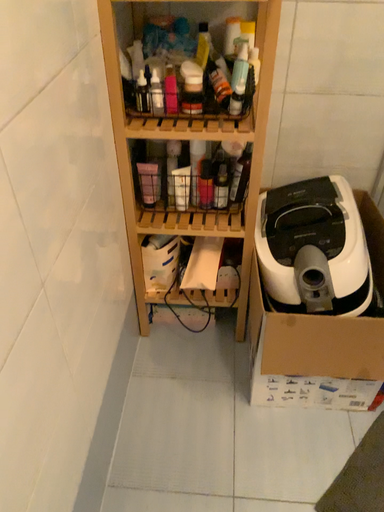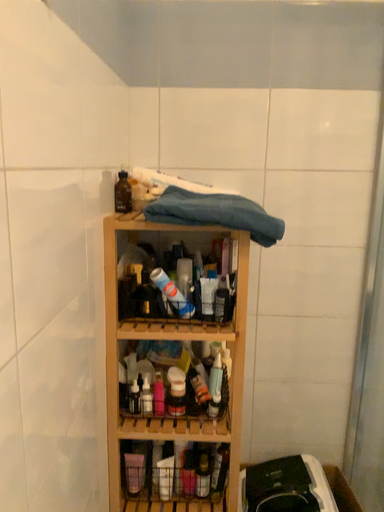
Question: Which way did the camera rotate in the video?

Choices:
 (A) rotated upward
 (B) rotated downward

Answer: (A)